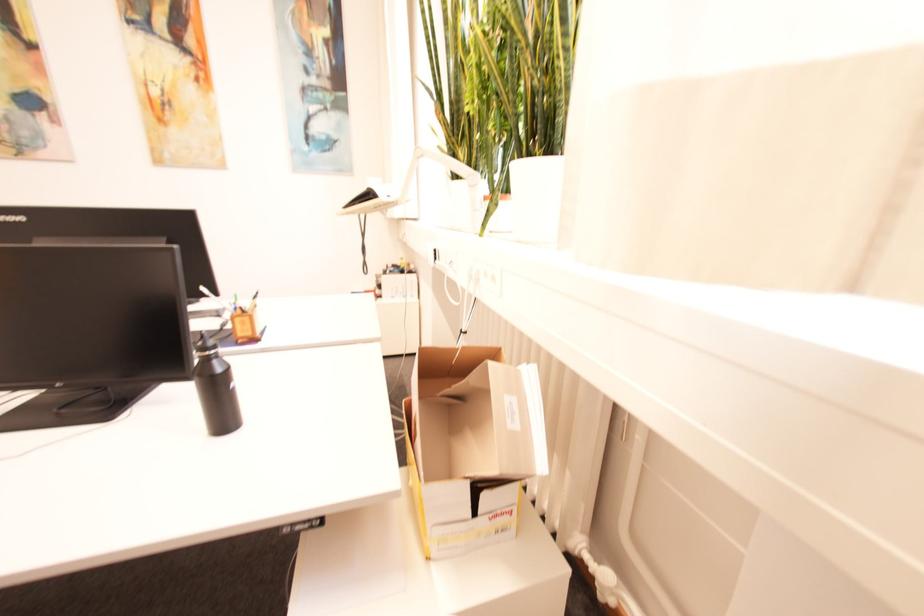
Locate an element on the screen. wooden pen holder is located at coordinates (244, 321).